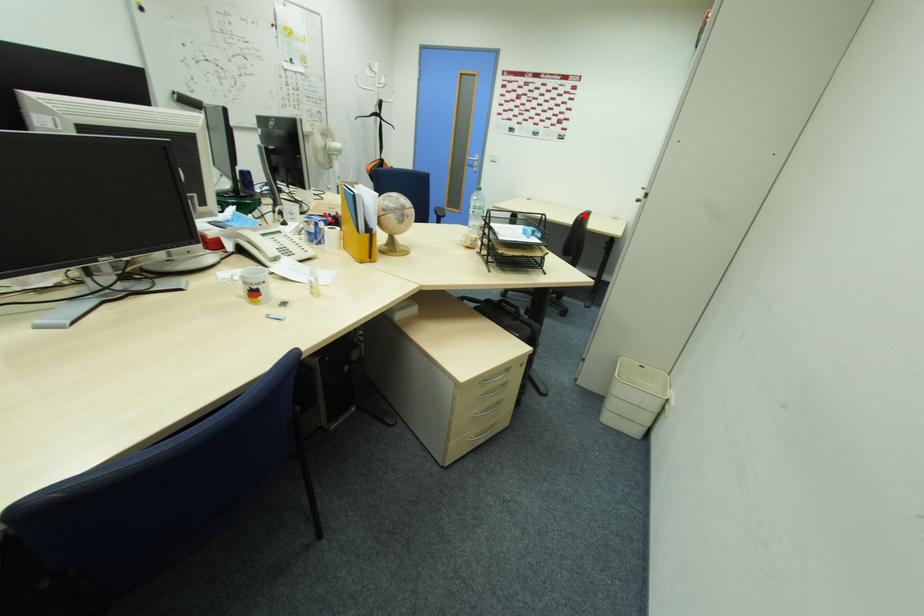
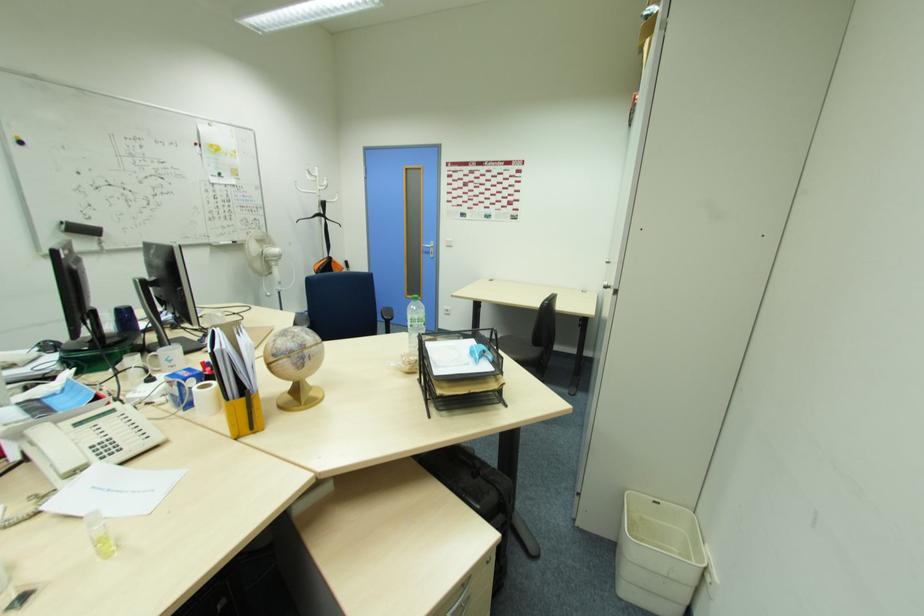
In the second image, find the point that corresponds to the highlighted location in the first image.

(549, 302)